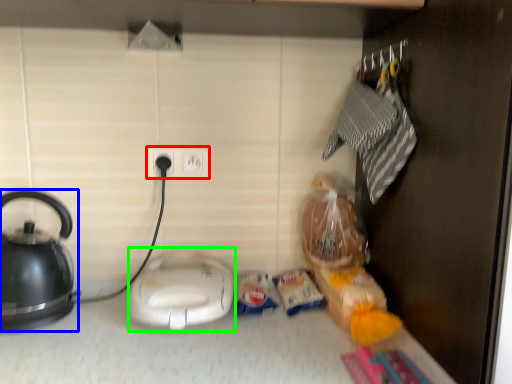
Question: Which is farther away from power plugs and sockets (highlighted by a red box)? kettle (highlighted by a blue box) or appliance (highlighted by a green box)?

Choices:
 (A) kettle
 (B) appliance

Answer: (A)